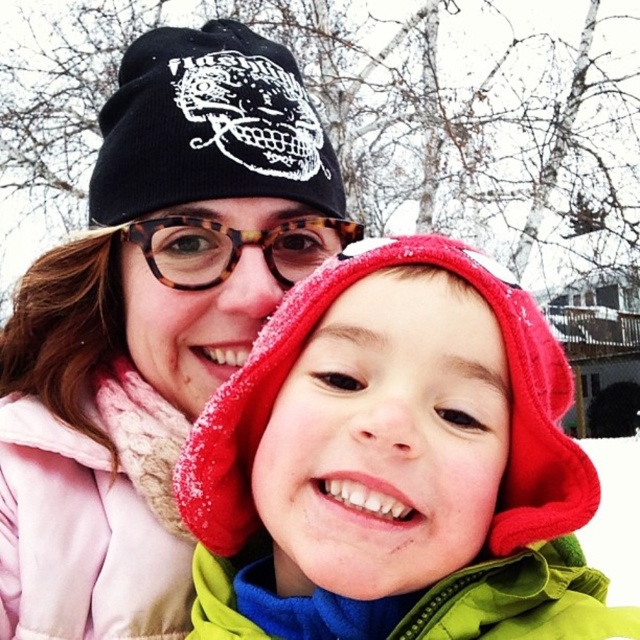
Question: Which of the following is the closest to the observer?

Choices:
 (A) matte black beanie at upper left
 (B) fuzzy fleece hood at center
 (C) black knit beanie at upper left

Answer: (B)

Question: Among these objects, which one is nearest to the camera?

Choices:
 (A) matte black beanie at upper left
 (B) tortoiseshell glasses at center

Answer: (A)

Question: Observing the image, what is the correct spatial positioning of black knit beanie at upper left in reference to tortoiseshell glasses at center?

Choices:
 (A) left
 (B) right

Answer: (A)

Question: Does matte black beanie at upper left have a lesser width compared to tortoiseshell glasses at center?

Choices:
 (A) yes
 (B) no

Answer: (B)

Question: Which point is closer to the camera taking this photo?

Choices:
 (A) (285, 582)
 (B) (108, 225)
 (C) (198, 321)

Answer: (A)

Question: Considering the relative positions of black knit beanie at upper left and tortoiseshell glasses at center in the image provided, where is black knit beanie at upper left located with respect to tortoiseshell glasses at center?

Choices:
 (A) above
 (B) below

Answer: (A)